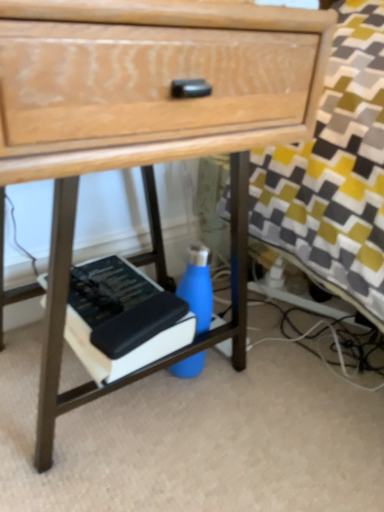
What do you see at coordinates (122, 319) in the screenshot? I see `hardcover book at lower center` at bounding box center [122, 319].

This screenshot has width=384, height=512. I want to click on hardcover book at lower center, so click(122, 319).

The width and height of the screenshot is (384, 512). Describe the element at coordinates (198, 286) in the screenshot. I see `blue matte water bottle at center` at that location.

The image size is (384, 512). I want to click on blue matte water bottle at center, so click(x=198, y=286).

Where is `hardcover book at lower center`? This screenshot has height=512, width=384. hardcover book at lower center is located at coordinates (122, 319).

Looking at this image, which is more to the left, blue matte water bottle at center or hardcover book at lower center?

Positioned to the left is hardcover book at lower center.

Considering the positions of objects blue matte water bottle at center and hardcover book at lower center in the image provided, who is behind, blue matte water bottle at center or hardcover book at lower center?

blue matte water bottle at center is more distant.

Is point (176, 376) more distant than point (164, 325)?

Yes, it is.

From the image's perspective, which one is positioned lower, blue matte water bottle at center or hardcover book at lower center?

blue matte water bottle at center.

From a real-world perspective, is blue matte water bottle at center on top of hardcover book at lower center?

No, from a real-world perspective, blue matte water bottle at center is not on top of hardcover book at lower center.

Considering the relative sizes of blue matte water bottle at center and hardcover book at lower center in the image provided, is blue matte water bottle at center thinner than hardcover book at lower center?

Indeed, blue matte water bottle at center has a lesser width compared to hardcover book at lower center.

Is blue matte water bottle at center shorter than hardcover book at lower center?

Incorrect, the height of blue matte water bottle at center does not fall short of that of hardcover book at lower center.

Who is bigger, blue matte water bottle at center or hardcover book at lower center?

hardcover book at lower center is bigger.

Is blue matte water bottle at center situated inside hardcover book at lower center or outside?

blue matte water bottle at center is not enclosed by hardcover book at lower center.

Consider the image. Is blue matte water bottle at center not close to hardcover book at lower center?

They are positioned close to each other.

Is blue matte water bottle at center oriented towards hardcover book at lower center?

No, blue matte water bottle at center is not oriented towards hardcover book at lower center.

How much distance is there between blue matte water bottle at center and hardcover book at lower center?

blue matte water bottle at center is 10.19 centimeters away from hardcover book at lower center.

Find the location of `bottle below the hardcover book at lower center (from a real-world perspective)`. bottle below the hardcover book at lower center (from a real-world perspective) is located at coordinates (198, 286).

Considering the positions of objects hardcover book at lower center and blue matte water bottle at center in the image provided, who is more to the right, hardcover book at lower center or blue matte water bottle at center?

Positioned to the right is blue matte water bottle at center.

In the scene shown: Which object is further away from the camera taking this photo, hardcover book at lower center or blue matte water bottle at center?

blue matte water bottle at center is further away from the camera.

Is point (152, 298) closer to camera compared to point (207, 304)?

Yes, it is.

From the image's perspective, which is above, hardcover book at lower center or blue matte water bottle at center?

hardcover book at lower center is shown above in the image.

From a real-world perspective, is hardcover book at lower center positioned above or below blue matte water bottle at center?

hardcover book at lower center is situated higher than blue matte water bottle at center in the real world.

Can you confirm if hardcover book at lower center is thinner than blue matte water bottle at center?

In fact, hardcover book at lower center might be wider than blue matte water bottle at center.

Can you confirm if hardcover book at lower center is shorter than blue matte water bottle at center?

Yes, hardcover book at lower center is shorter than blue matte water bottle at center.

Based on the photo, considering the sizes of objects hardcover book at lower center and blue matte water bottle at center in the image provided, who is smaller, hardcover book at lower center or blue matte water bottle at center?

blue matte water bottle at center is smaller.

Is blue matte water bottle at center completely or partially inside hardcover book at lower center?

Actually, blue matte water bottle at center is outside hardcover book at lower center.

Are hardcover book at lower center and blue matte water bottle at center beside each other?

hardcover book at lower center is not next to blue matte water bottle at center, and they're not touching.

Is hardcover book at lower center oriented towards blue matte water bottle at center?

No, hardcover book at lower center is not turned towards blue matte water bottle at center.

Find the location of a particular element. The width and height of the screenshot is (384, 512). paperback book located above the blue matte water bottle at center (from a real-world perspective) is located at coordinates (122, 319).

Find the location of `bottle that is below the hardcover book at lower center (from the image's perspective)`. bottle that is below the hardcover book at lower center (from the image's perspective) is located at coordinates (198, 286).

Where is `paperback book that appears on the left of blue matte water bottle at center`? Image resolution: width=384 pixels, height=512 pixels. paperback book that appears on the left of blue matte water bottle at center is located at coordinates (122, 319).